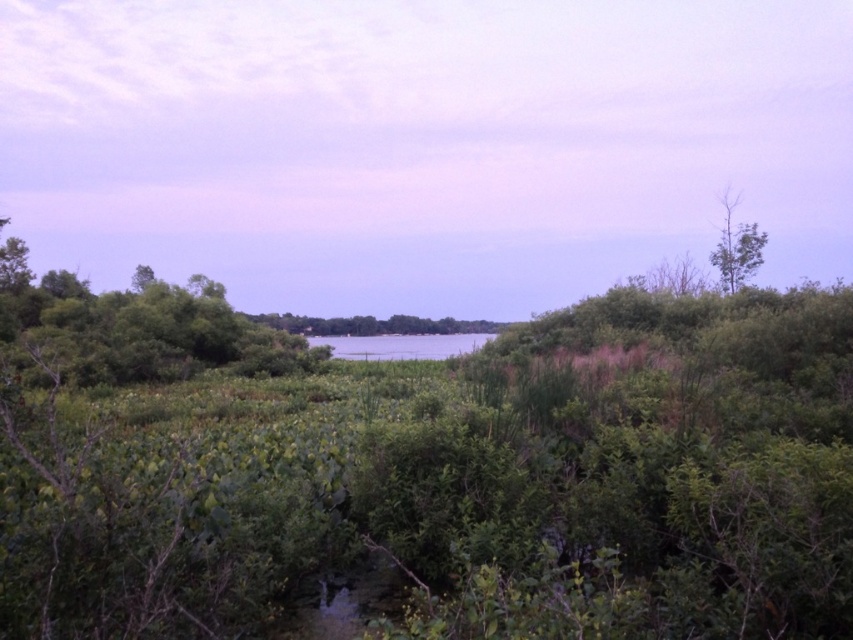
Does green leafy tree at left appear under green leafy tree at upper right?

Indeed, green leafy tree at left is positioned under green leafy tree at upper right.

Where is `green leafy tree at left`? The height and width of the screenshot is (640, 853). green leafy tree at left is located at coordinates (138, 326).

Who is more distant from viewer, [126,291] or [724,220]?

Positioned behind is point [724,220].

Locate an element on the screen. The image size is (853, 640). green leafy tree at left is located at coordinates (138, 326).

Does green leafy tree at left have a larger size compared to green leafy tree at center?

Yes, green leafy tree at left is bigger than green leafy tree at center.

Who is positioned more to the left, green leafy tree at left or green leafy tree at center?

green leafy tree at left

Is point (149, 356) positioned before point (263, 320)?

Yes, point (149, 356) is in front of point (263, 320).

Identify the location of green leafy tree at left. The image size is (853, 640). (138, 326).

Who is higher up, green leafy tree at center or green leafy tree at upper right?

green leafy tree at upper right

What do you see at coordinates (374, 324) in the screenshot? I see `green leafy tree at center` at bounding box center [374, 324].

Where is `green leafy tree at center`? This screenshot has height=640, width=853. green leafy tree at center is located at coordinates (374, 324).